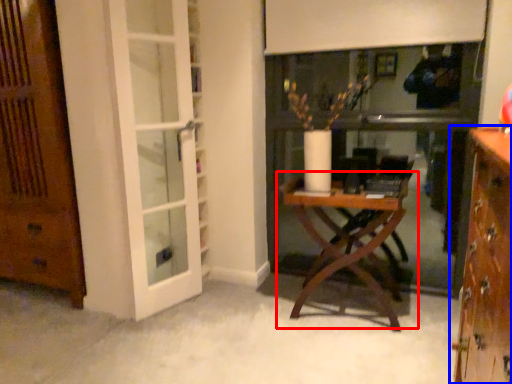
Question: Among these objects, which one is farthest to the camera, table (highlighted by a red box) or cabinetry (highlighted by a blue box)?

Choices:
 (A) table
 (B) cabinetry

Answer: (A)